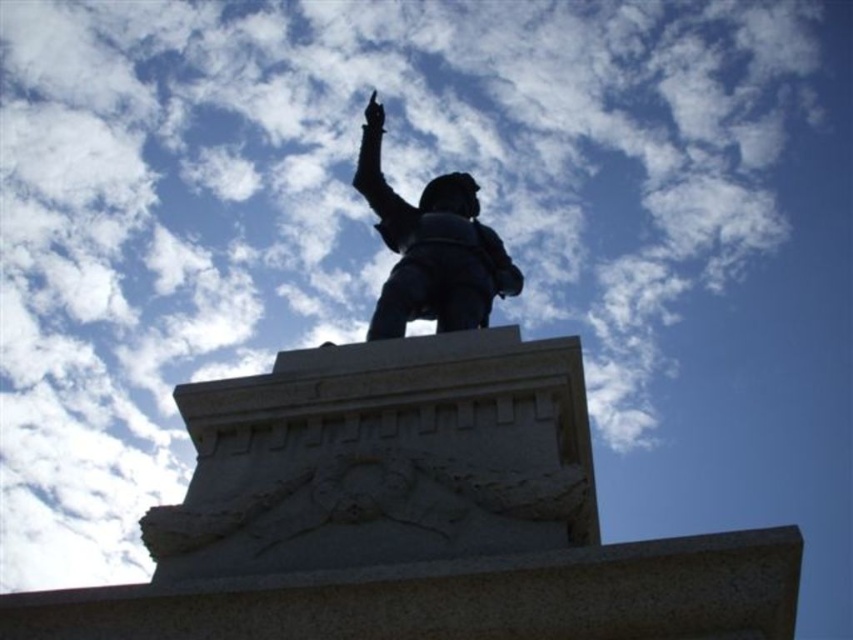
Question: Does black metal statue at center have a larger size compared to bronze statue at center?

Choices:
 (A) no
 (B) yes

Answer: (B)

Question: Among these objects, which one is nearest to the camera?

Choices:
 (A) black metal statue at center
 (B) bronze statue at center

Answer: (A)

Question: Which point appears farthest from the camera in this image?

Choices:
 (A) (451, 204)
 (B) (408, 435)

Answer: (A)

Question: Is black metal statue at center in front of bronze statue at center?

Choices:
 (A) yes
 (B) no

Answer: (A)

Question: Does black metal statue at center lie behind bronze statue at center?

Choices:
 (A) yes
 (B) no

Answer: (B)

Question: Among these points, which one is nearest to the camera?

Choices:
 (A) (386, 230)
 (B) (286, 432)

Answer: (B)